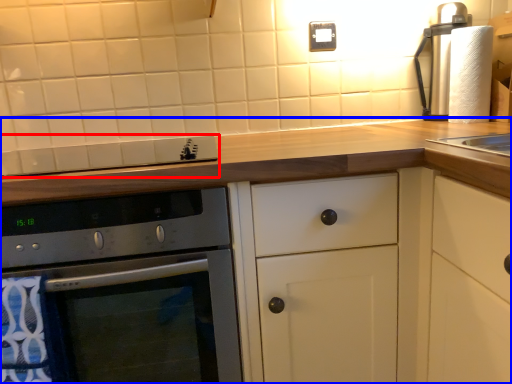
Question: Which object is further to the camera taking this photo, gas stove (highlighted by a red box) or cabinetry (highlighted by a blue box)?

Choices:
 (A) gas stove
 (B) cabinetry

Answer: (A)